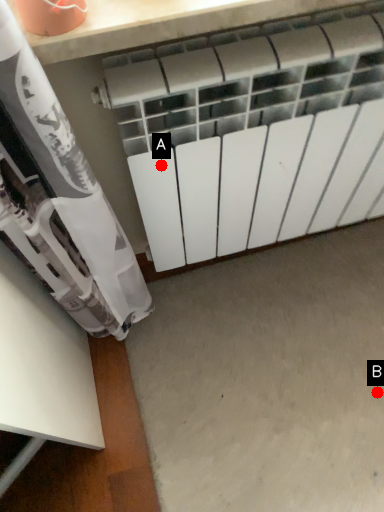
Question: Two points are circled on the image, labeled by A and B beside each circle. Which point is further to the camera?

Choices:
 (A) A is further
 (B) B is further

Answer: (B)